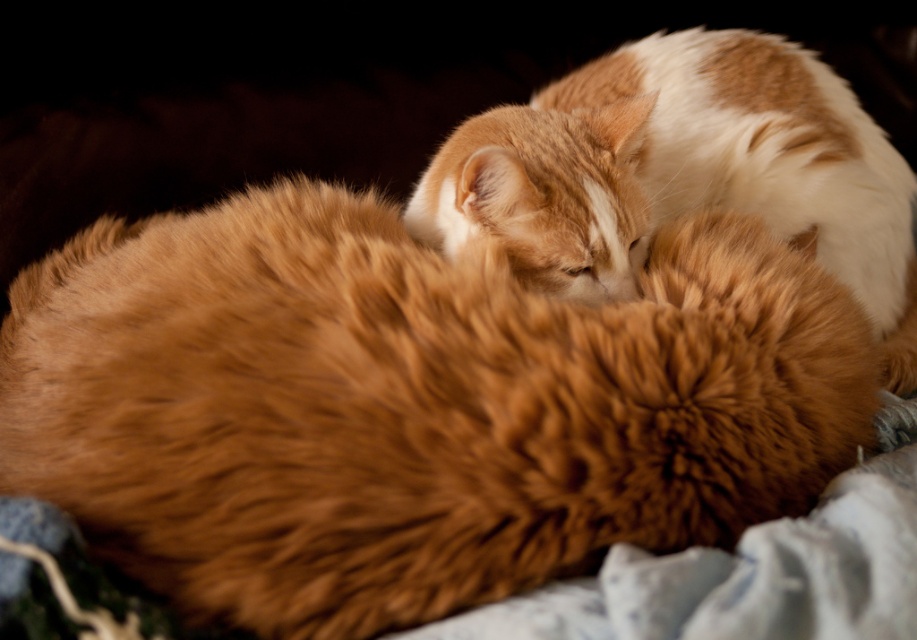
Question: Which of the following is the closest to the observer?

Choices:
 (A) orange fur cat at upper right
 (B) fluffy orange cat at center

Answer: (B)

Question: Does fluffy orange cat at center have a smaller size compared to orange fur cat at upper right?

Choices:
 (A) yes
 (B) no

Answer: (A)

Question: Is fluffy orange cat at center thinner than orange fur cat at upper right?

Choices:
 (A) yes
 (B) no

Answer: (B)

Question: Which point is closer to the camera taking this photo?

Choices:
 (A) (403, 552)
 (B) (612, 211)

Answer: (A)

Question: Among these points, which one is farthest from the camera?

Choices:
 (A) (893, 323)
 (B) (683, 224)

Answer: (A)

Question: Can you confirm if fluffy orange cat at center is positioned below orange fur cat at upper right?

Choices:
 (A) no
 (B) yes

Answer: (B)